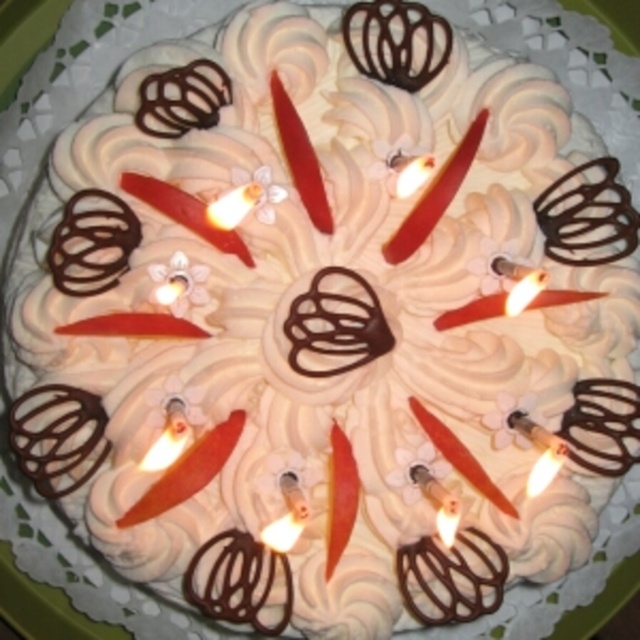
Question: Is matte red candle at upper center in front of matte red candle at center?

Choices:
 (A) no
 (B) yes

Answer: (A)

Question: Among these points, which one is farthest from the camera?

Choices:
 (A) (529, 486)
 (B) (468, 138)

Answer: (B)

Question: Does matte red candle at upper center have a lesser width compared to white wax candle at center?

Choices:
 (A) yes
 (B) no

Answer: (B)

Question: Where is matte red candle at center located in relation to white wax candle at center in the image?

Choices:
 (A) left
 (B) right

Answer: (A)

Question: Which of the following is the closest to the observer?

Choices:
 (A) (525, 488)
 (B) (444, 164)
 (C) (312, 186)

Answer: (C)

Question: Based on their relative distances, which object is nearer to the matte red candle at center?

Choices:
 (A) matte red candle at upper center
 (B) white wax candle at center

Answer: (A)